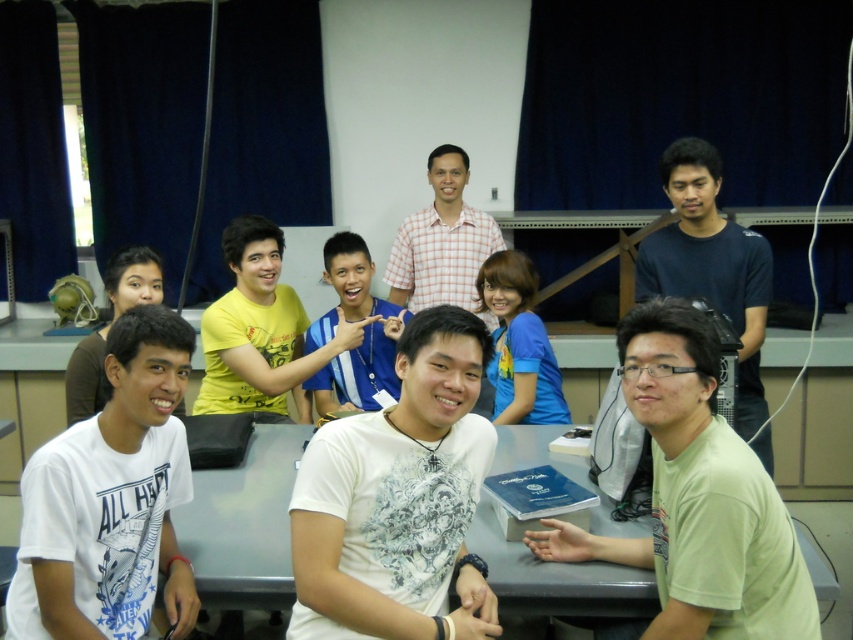
You are a photographer taking a group photo of the scene. You notice two people in the front row wearing a white matte shirt at center and a yellow matte shirt at center. To ensure both are visible in the photo, which person should you position closer to the camera?

The white matte shirt at center is shorter than the yellow matte shirt at center, so positioning the white matte shirt at center closer to the camera will ensure both are visible.

You are organizing a small workshop and need to seat all attendees comfortably. The gray plastic table at center is the only table available. Considering the size of the matte black shirt at left, will the table be long enough to accommodate everyone?

The gray plastic table at center is wider than the matte black shirt at left, but since the description only provides a comparison between their sizes and not the actual dimensions required for seating, it is unclear if the table will be long enough to accommodate everyone.